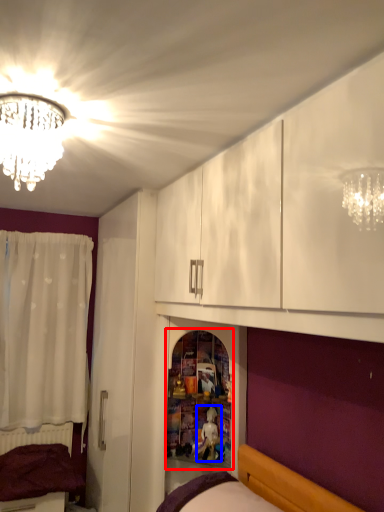
Question: Which object appears farthest to the camera in this image, shelf (highlighted by a red box) or toy (highlighted by a blue box)?

Choices:
 (A) shelf
 (B) toy

Answer: (B)